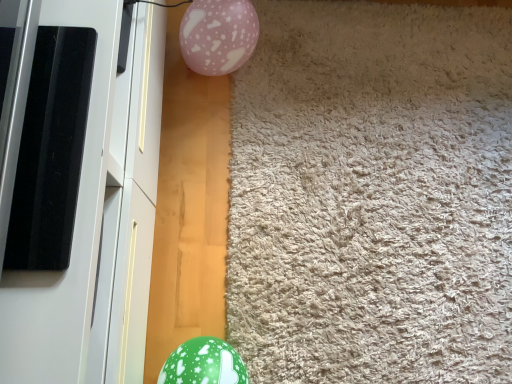
Identify the location of vacant space behind green glossy balloon at lower left. (248, 286).